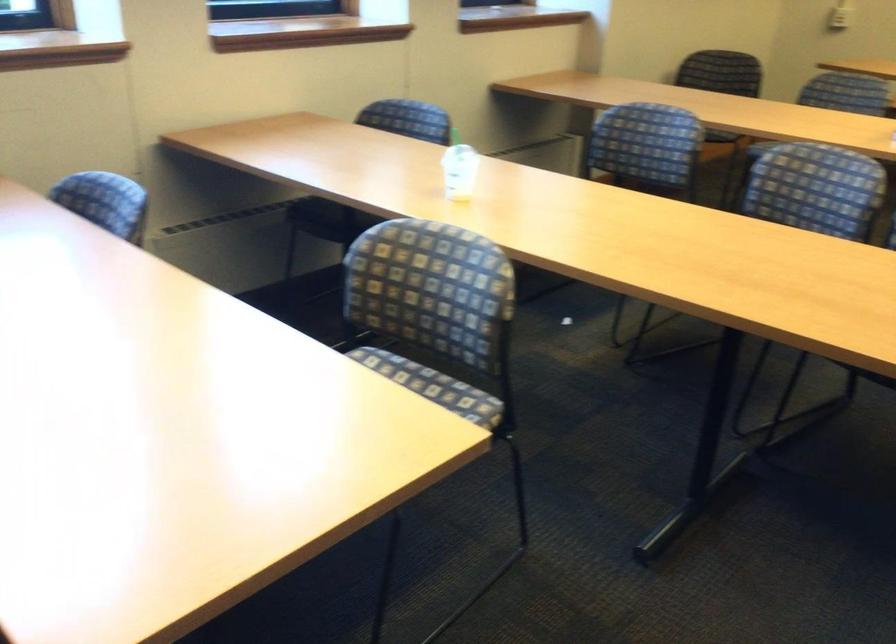
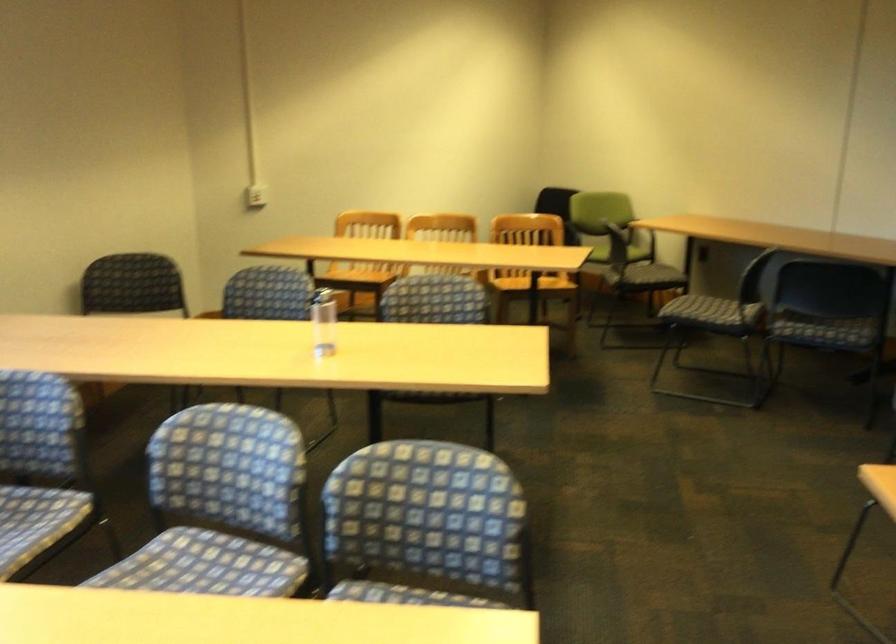
Where in the second image is the point corresponding to pixel 795 211 from the first image?

(221, 506)